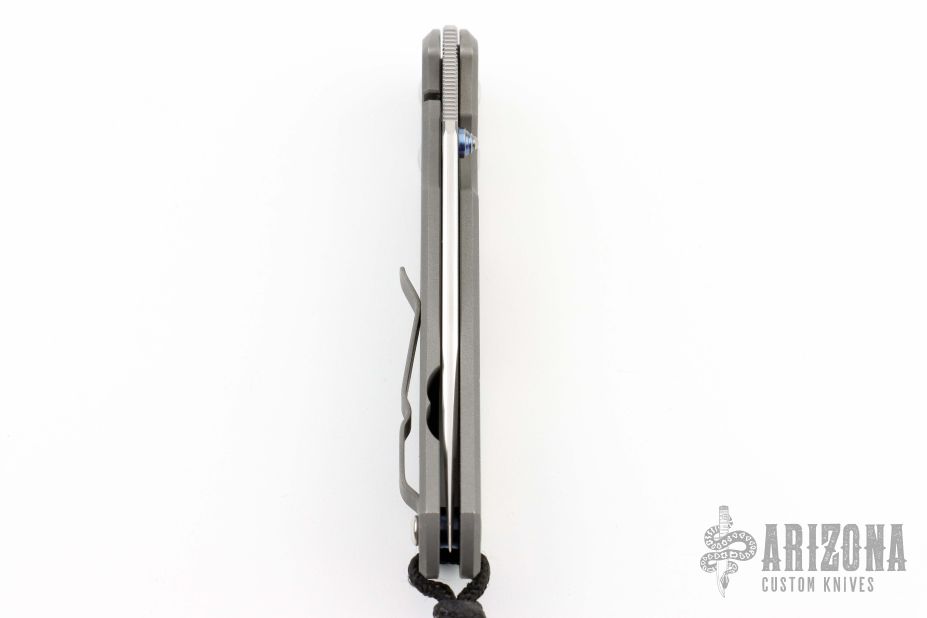
Image resolution: width=927 pixels, height=618 pixels. I want to click on knives, so click(x=836, y=586).